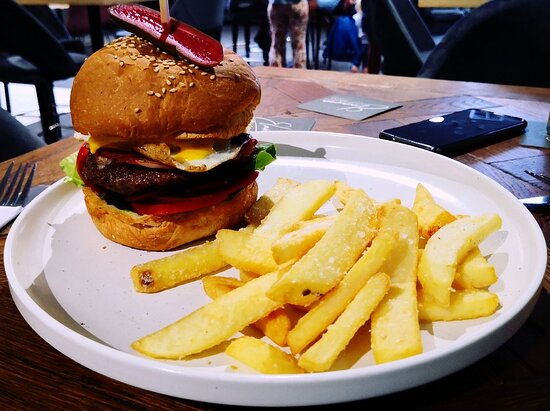
Identify the location of plate. (80, 258).